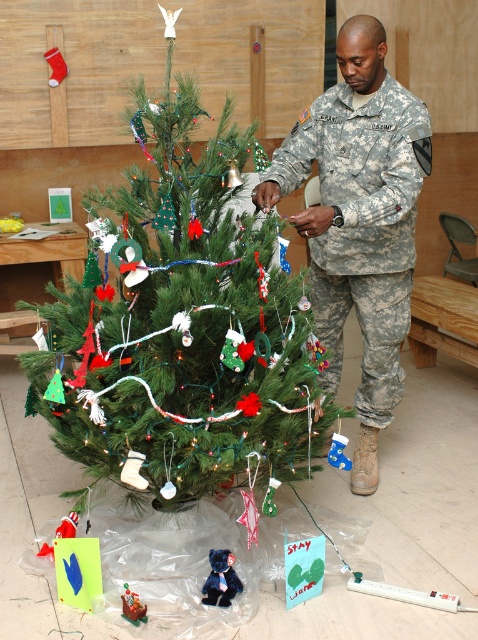
Question: Which of the following is the closest to the observer?

Choices:
 (A) plush red santa at lower left
 (B) green matte christmas tree at center
 (C) velvety blue teddy bear at center

Answer: (B)

Question: Which is nearer to the metallic silver sleigh at center?

Choices:
 (A) velvety blue teddy bear at center
 (B) plush red santa at lower left
 (C) green matte christmas tree at center
 (D) camouflage uniform at center

Answer: (A)

Question: Is green matte christmas tree at center to the left of metallic silver sleigh at center from the viewer's perspective?

Choices:
 (A) yes
 (B) no

Answer: (B)

Question: Can you confirm if green matte christmas tree at center is positioned to the left of velvety blue teddy bear at center?

Choices:
 (A) no
 (B) yes

Answer: (B)

Question: Is metallic silver sleigh at center to the right of plush red santa at lower left from the viewer's perspective?

Choices:
 (A) no
 (B) yes

Answer: (B)

Question: Which point is closer to the camera?

Choices:
 (A) camouflage uniform at center
 (B) plush red santa at lower left
 (C) green matte christmas tree at center

Answer: (C)